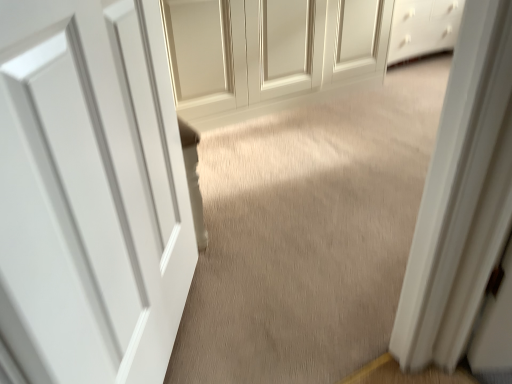
What do you see at coordinates (308, 235) in the screenshot?
I see `beige carpet at center` at bounding box center [308, 235].

At what (x,y) coordinates should I click in order to perform the action: click on white smooth door at center, which appears as the second door when viewed from the top. Please return your answer as a coordinate pair (x, y). This screenshot has height=384, width=512. Looking at the image, I should click on (90, 194).

Where is `beige carpet at center`? The width and height of the screenshot is (512, 384). beige carpet at center is located at coordinates (308, 235).

From the image's perspective, relative to white smooth door at center, which is the 1th door in front-to-back order, is beige carpet at center above or below?

beige carpet at center is above white smooth door at center, which is the 1th door in front-to-back order.

From a real-world perspective, which object stands above the other?

white smooth door at center, which appears as the second door when viewed from the top.

Is beige carpet at center next to white smooth door at center, which appears as the second door when viewed from the top?

No, beige carpet at center is not beside white smooth door at center, which appears as the second door when viewed from the top.

Considering the sizes of beige carpet at center and white smooth door at center, acting as the 1th door starting from the left, in the image, is beige carpet at center wider or thinner than white smooth door at center, acting as the 1th door starting from the left,?

In the image, beige carpet at center appears to be wider than white smooth door at center, acting as the 1th door starting from the left.

Can you tell me how much beige carpet at center and matte white door at center, the second door viewed from the front, differ in facing direction?

beige carpet at center and matte white door at center, the second door viewed from the front, are facing 88.9 degrees away from each other.

From a real-world perspective, who is located lower, beige carpet at center or matte white door at center, the second door viewed from the front?

In real-world perspective, beige carpet at center is lower.

Which of these two, beige carpet at center or matte white door at center, positioned as the 2th door in bottom-to-top order, is thinner?

Thinner between the two is matte white door at center, positioned as the 2th door in bottom-to-top order.

Looking at this image, would you say matte white door at center, positioned as the 2th door in bottom-to-top order, is part of beige carpet at center's contents?

No, matte white door at center, positioned as the 2th door in bottom-to-top order, is not surrounded by beige carpet at center.

Considering the relative sizes of white smooth door at center, the second door in the back-to-front sequence, and beige carpet at center in the image provided, is white smooth door at center, the second door in the back-to-front sequence, bigger than beige carpet at center?

Actually, white smooth door at center, the second door in the back-to-front sequence, might be smaller than beige carpet at center.

Considering the positions of objects white smooth door at center, which is the 1th door in front-to-back order, and beige carpet at center in the image provided, who is in front, white smooth door at center, which is the 1th door in front-to-back order, or beige carpet at center?

white smooth door at center, which is the 1th door in front-to-back order, is more forward.

Which is closer, (19, 24) or (311, 347)?

Clearly, point (19, 24) is closer to the camera than point (311, 347).

Who is taller, white smooth door at center, the second door in the back-to-front sequence, or beige carpet at center?

white smooth door at center, the second door in the back-to-front sequence.

Considering the sizes of matte white door at center, which is counted as the 1th door, starting from the right, and beige carpet at center in the image, is matte white door at center, which is counted as the 1th door, starting from the right, wider or thinner than beige carpet at center?

matte white door at center, which is counted as the 1th door, starting from the right, is thinner than beige carpet at center.

Is matte white door at center, the 1th door positioned from the top, not within beige carpet at center?

Yes, matte white door at center, the 1th door positioned from the top, is outside of beige carpet at center.

Is matte white door at center, the second door viewed from the front, directly adjacent to beige carpet at center?

matte white door at center, the second door viewed from the front, is not next to beige carpet at center, and they're not touching.

From a real-world perspective, is matte white door at center, positioned as the 2th door in bottom-to-top order, above or below white smooth door at center, which appears as the second door when viewed from the top?

Clearly, from a real-world perspective, matte white door at center, positioned as the 2th door in bottom-to-top order, is below white smooth door at center, which appears as the second door when viewed from the top.

Who is more distant, matte white door at center, the first door when ordered from back to front, or white smooth door at center, which appears as the second door when viewed from the top?

matte white door at center, the first door when ordered from back to front, is more distant.

Is point (343, 67) positioned behind point (175, 329)?

Yes, point (343, 67) is behind point (175, 329).

Does white smooth door at center, the second door in the back-to-front sequence, lie in front of matte white door at center, the second door viewed from the front?

Yes, white smooth door at center, the second door in the back-to-front sequence, is closer to the camera.

From a real-world perspective, between white smooth door at center, the second door in the back-to-front sequence, and matte white door at center, which is counted as the 1th door, starting from the right, who is vertically higher?

In real-world perspective, white smooth door at center, the second door in the back-to-front sequence, is above.

Consider the image. Considering the positions of objects white smooth door at center, acting as the 2th door starting from the right, and matte white door at center, the 1th door positioned from the top, in the image provided, who is more to the right, white smooth door at center, acting as the 2th door starting from the right, or matte white door at center, the 1th door positioned from the top,?

matte white door at center, the 1th door positioned from the top.

Is white smooth door at center, which appears as the second door when viewed from the top, surrounding matte white door at center, the 1th door positioned from the top?

No, matte white door at center, the 1th door positioned from the top, is not surrounded by white smooth door at center, which appears as the second door when viewed from the top.

Starting from the beige carpet at center, which door is the 2nd one to the left? Please provide its 2D coordinates.

[(90, 194)]

From a real-world perspective, which door is the 1st one above the beige carpet at center? Please provide its 2D coordinates.

[(264, 51)]

Which object lies further to the anchor point matte white door at center, the 1th door positioned from the top, beige carpet at center or white smooth door at center, the second door in the back-to-front sequence?

white smooth door at center, the second door in the back-to-front sequence.

Based on their spatial positions, is matte white door at center, positioned as the 2th door in bottom-to-top order, or beige carpet at center closer to white smooth door at center, which is the 1th door in front-to-back order?

beige carpet at center lies closer to white smooth door at center, which is the 1th door in front-to-back order, than the other object.

From the image, which object appears to be farther from white smooth door at center, the second door in the back-to-front sequence, beige carpet at center or matte white door at center, which is counted as the 1th door, starting from the right?

matte white door at center, which is counted as the 1th door, starting from the right, is positioned further to the anchor white smooth door at center, the second door in the back-to-front sequence.

Which object lies further to the anchor point matte white door at center, the first door when ordered from back to front, white smooth door at center, which ranks as the 1th door in bottom-to-top order, or beige carpet at center?

white smooth door at center, which ranks as the 1th door in bottom-to-top order, is further to matte white door at center, the first door when ordered from back to front.

Looking at the image, which one is located further to beige carpet at center, white smooth door at center, the second door in the back-to-front sequence, or matte white door at center, the 1th door positioned from the top?

Among the two, white smooth door at center, the second door in the back-to-front sequence, is located further to beige carpet at center.

Looking at the image, which one is located further to beige carpet at center, matte white door at center, the first door when ordered from back to front, or white smooth door at center, acting as the 2th door starting from the right?

white smooth door at center, acting as the 2th door starting from the right, is further to beige carpet at center.

Locate an element on the screen. This screenshot has height=384, width=512. plain between white smooth door at center, which is the 1th door in front-to-back order, and matte white door at center, the 1th door positioned from the top, from front to back is located at coordinates (308, 235).